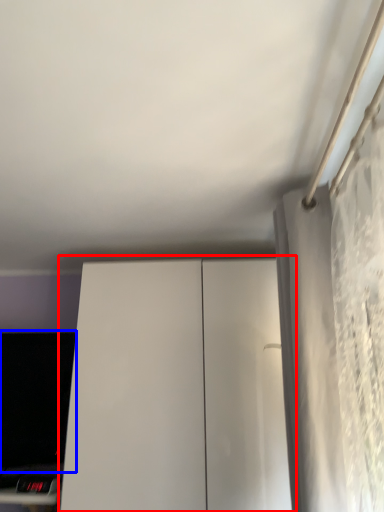
Question: Which object is further to the camera taking this photo, dresser (highlighted by a red box) or computer monitor (highlighted by a blue box)?

Choices:
 (A) dresser
 (B) computer monitor

Answer: (B)